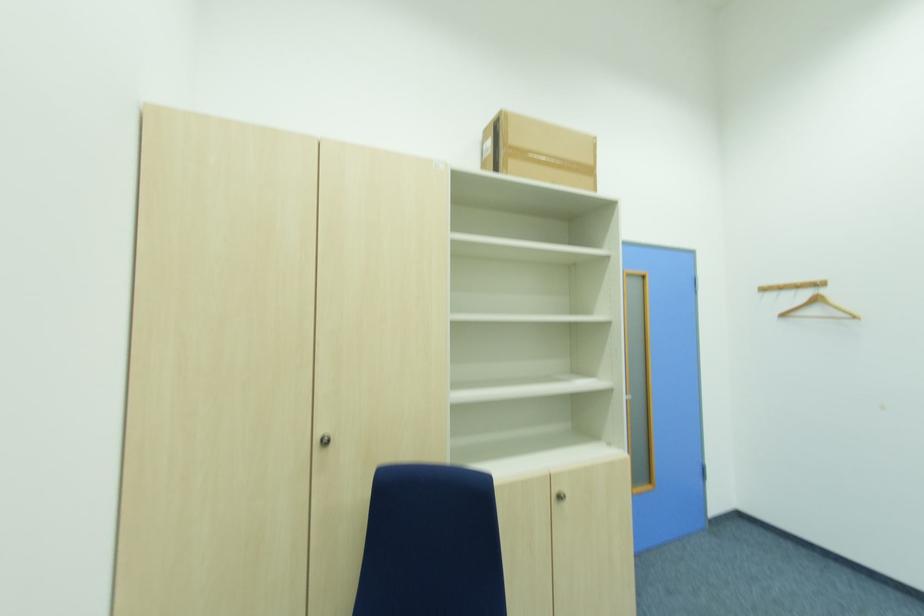
Where is `wooden coat hanger`? Image resolution: width=924 pixels, height=616 pixels. wooden coat hanger is located at coordinates (808, 299).